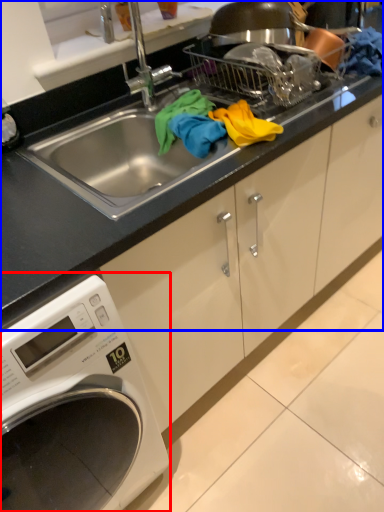
Question: Among these objects, which one is farthest to the camera, washing machine (highlighted by a red box) or countertop (highlighted by a blue box)?

Choices:
 (A) washing machine
 (B) countertop

Answer: (B)